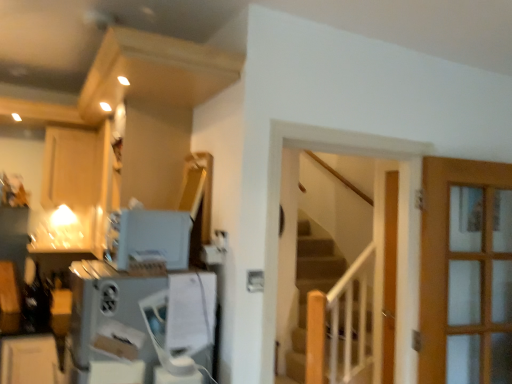
Question: In the image, is satin white toaster at upper center, which ranks as the second appliance in bottom-to-top order, positioned in front of or behind satin silver appliance at lower left, which appears as the second appliance when viewed from the top?

Choices:
 (A) front
 (B) behind

Answer: (B)

Question: From the image's perspective, relative to satin silver appliance at lower left, the 1th appliance from the bottom, is satin white toaster at upper center, arranged as the 1th appliance when viewed from the top, above or below?

Choices:
 (A) above
 (B) below

Answer: (A)

Question: Which object is the closest to the satin white toaster at upper center, which ranks as the second appliance in bottom-to-top order?

Choices:
 (A) satin silver appliance at lower left, which appears as the second appliance when viewed from the top
 (B) wooden stairs at center
 (C) matte wood cabinet at upper left

Answer: (A)

Question: Which object is the farthest from the matte wood cabinet at upper left?

Choices:
 (A) satin white toaster at upper center, arranged as the 1th appliance when viewed from the top
 (B) wooden stairs at center
 (C) satin silver appliance at lower left, which appears as the second appliance when viewed from the top

Answer: (B)